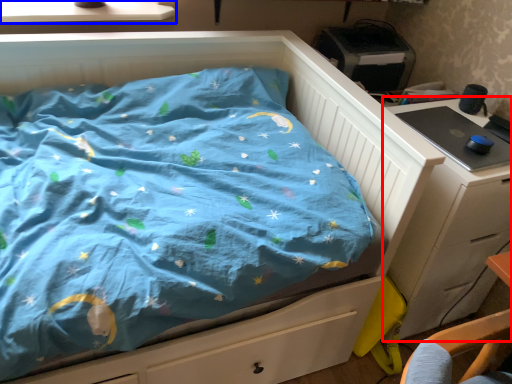
Question: Which of the following is the farthest to the observer, chest of drawers (highlighted by a red box) or window sill (highlighted by a blue box)?

Choices:
 (A) chest of drawers
 (B) window sill

Answer: (B)